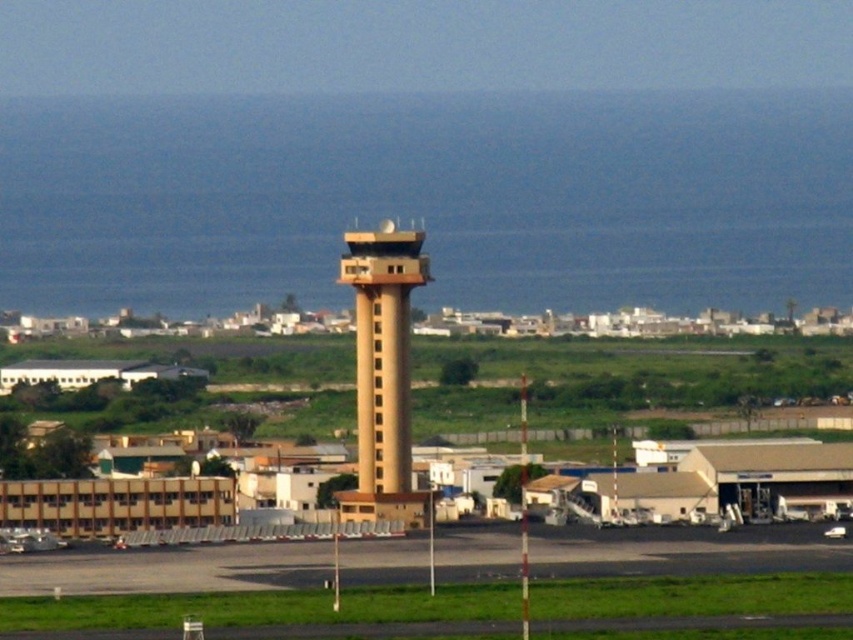
You are a pilot preparing for takeoff and need to locate the control tower. Based on the scene, where is the tan concrete control tower at center in relation to the black asphalt runway at lower center?

The tan concrete control tower at center is above the black asphalt runway at lower center.

You are a pilot preparing for takeoff and need to align your aircraft with the runway. Based on the airport layout shown, where is the black asphalt runway at lower center positioned relative to the airport control tower?

The black asphalt runway at lower center is positioned at point coordinates (685, 550), which means it is located to the lower right of the control tower, requiring you to align your aircraft in that direction for takeoff.

You are a drone operator trying to navigate between two points in the airport image. The first point is point [26,582] and the second point is point [347,232]. Which point is closer to the camera?

Point [347,232] is closer to the camera because the point [26,582] is further away according to the description.